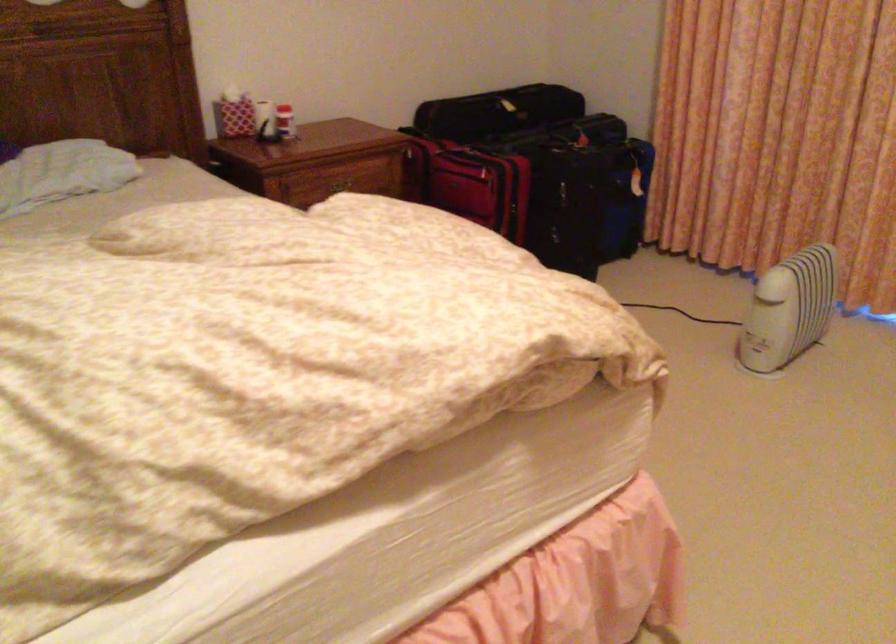
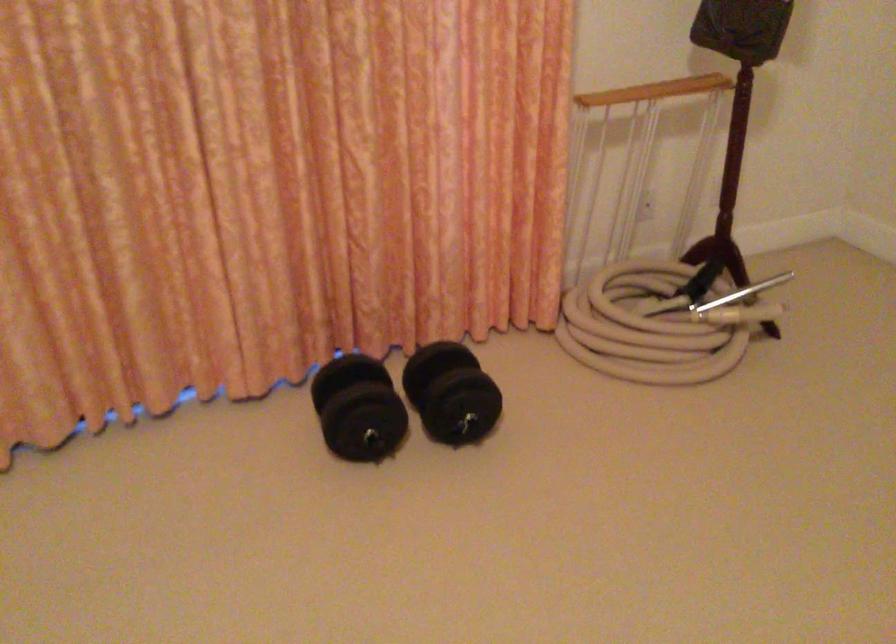
Question: Based on the continuous images, in which direction is the camera rotating? Reply with the corresponding letter.

Choices:
 (A) Left
 (B) Right
 (C) Up
 (D) Down

Answer: (B)